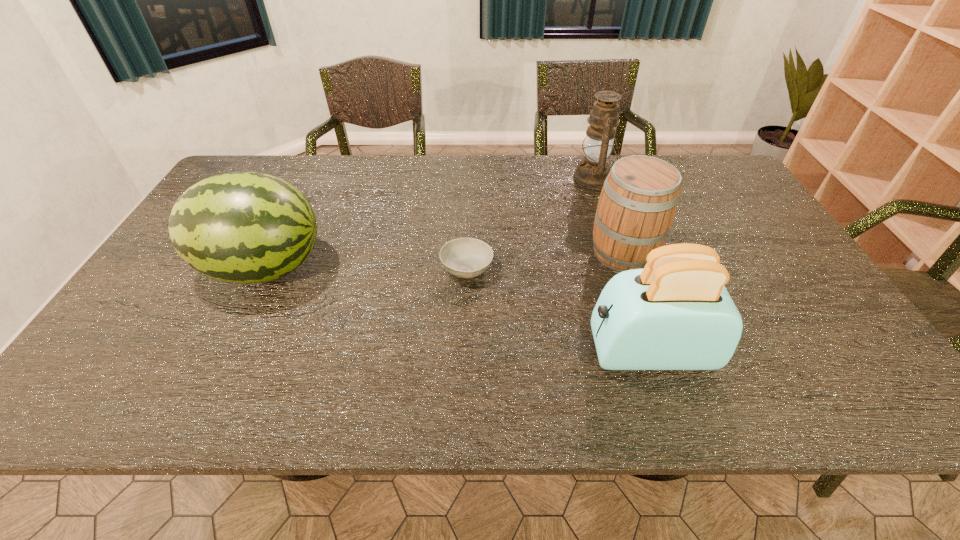
This screenshot has width=960, height=540. I want to click on free space located at the stem end of the watermelon, so click(362, 268).

In order to click on free region located 0.290m on the right of the cider in this screenshot , I will do `click(764, 253)`.

Identify the location of vacant space situated 0.140m on the right of the second object from left to right. (546, 269).

Find the location of a particular element. This screenshot has width=960, height=540. object at the far edge is located at coordinates tap(592, 171).

Find the location of a particular element. This screenshot has height=540, width=960. object that is positioned at the near edge is located at coordinates (675, 314).

Image resolution: width=960 pixels, height=540 pixels. I want to click on object present at the left edge, so click(x=241, y=227).

You are a GUI agent. You are given a task and a screenshot of the screen. Output one action in this format:
    pyautogui.click(x=<x>, y=<y>)
    Task: Click on the free region at the far edge
    The height and width of the screenshot is (540, 960).
    Given the screenshot: What is the action you would take?
    pyautogui.click(x=406, y=190)

At what (x,y) coordinates should I click in order to perform the action: click on vacant space at the near edge of the desktop. Please return your answer as a coordinate pair (x, y). The image size is (960, 540). Looking at the image, I should click on (194, 409).

Locate an element on the screen. free space at the left edge of the desktop is located at coordinates (156, 361).

In order to click on vacant space at the right edge of the desktop in this screenshot , I will do `click(823, 336)`.